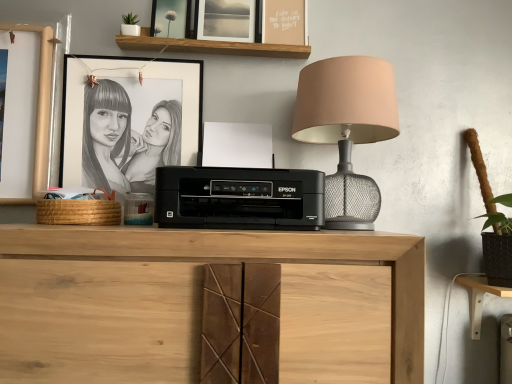
Question: Which direction should I rotate to look at white matte picture frame at upper center, the first picture frame viewed from the top, — up or down?

Choices:
 (A) up
 (B) down

Answer: (A)

Question: Does natural wood cabinet at center appear on the right side of brown woven basket at left?

Choices:
 (A) yes
 (B) no

Answer: (A)

Question: Is the surface of natural wood cabinet at center in direct contact with brown woven basket at left?

Choices:
 (A) no
 (B) yes

Answer: (A)

Question: From the image's perspective, is natural wood cabinet at center located above brown woven basket at left?

Choices:
 (A) no
 (B) yes

Answer: (A)

Question: From the image's perspective, is natural wood cabinet at center located beneath brown woven basket at left?

Choices:
 (A) no
 (B) yes

Answer: (B)

Question: Is natural wood cabinet at center positioned with its back to brown woven basket at left?

Choices:
 (A) no
 (B) yes

Answer: (A)

Question: Would you say natural wood cabinet at center is outside brown woven basket at left?

Choices:
 (A) yes
 (B) no

Answer: (A)

Question: From a real-world perspective, does matte glass picture frame at upper center, which is counted as the 2th picture frame, starting from the bottom, sit lower than white matte picture frame at upper center, the first picture frame viewed from the top?

Choices:
 (A) no
 (B) yes

Answer: (B)

Question: Does matte glass picture frame at upper center, acting as the second picture frame starting from the top, have a greater width compared to white matte picture frame at upper center, the first picture frame viewed from the top?

Choices:
 (A) no
 (B) yes

Answer: (B)

Question: Does matte glass picture frame at upper center, which is counted as the 2th picture frame, starting from the bottom, have a smaller size compared to white matte picture frame at upper center, acting as the third picture frame starting from the bottom?

Choices:
 (A) no
 (B) yes

Answer: (B)

Question: Is matte glass picture frame at upper center, which is counted as the 2th picture frame, starting from the bottom, behind white matte picture frame at upper center, acting as the third picture frame starting from the bottom?

Choices:
 (A) yes
 (B) no

Answer: (A)

Question: Is white matte picture frame at upper center, acting as the third picture frame starting from the bottom, inside matte glass picture frame at upper center, which is counted as the 2th picture frame, starting from the bottom?

Choices:
 (A) yes
 (B) no

Answer: (B)

Question: Is matte glass picture frame at upper center, acting as the second picture frame starting from the top, outside white matte picture frame at upper center, the first picture frame viewed from the top?

Choices:
 (A) yes
 (B) no

Answer: (A)

Question: Is black plastic printer at center at the right side of white matte picture frame at upper center, the first picture frame viewed from the top?

Choices:
 (A) yes
 (B) no

Answer: (A)